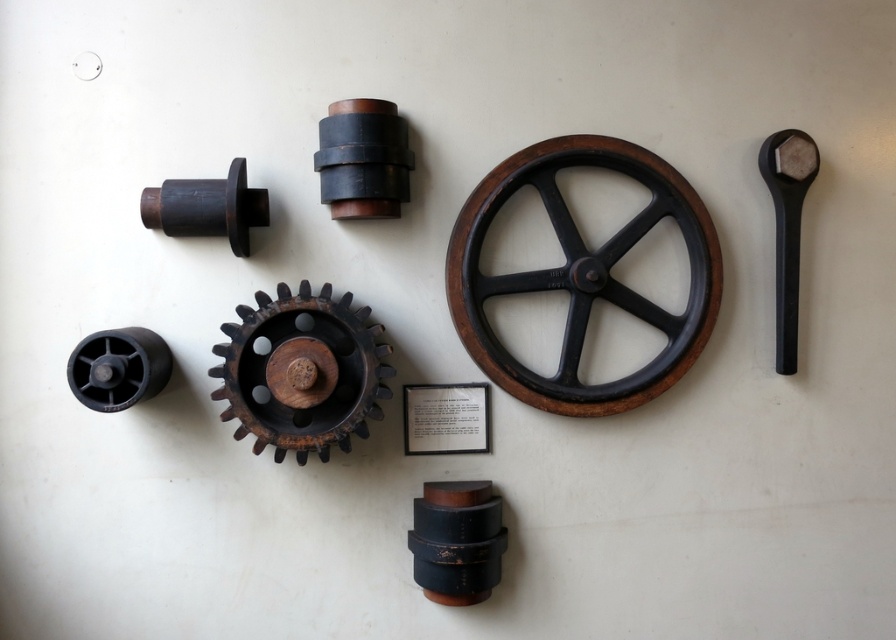
Question: Does matte black cylinder at upper left lie in front of black rubber wheel at lower left?

Choices:
 (A) no
 (B) yes

Answer: (A)

Question: Is the position of matte black cylinder at upper center more distant than that of matte black cylinder at upper left?

Choices:
 (A) yes
 (B) no

Answer: (A)

Question: Is wooden/black wheel at center smaller than rusty metal gear at center?

Choices:
 (A) no
 (B) yes

Answer: (A)

Question: Among these points, which one is nearest to the camera?

Choices:
 (A) (231, 401)
 (B) (169, 220)
 (C) (87, 401)

Answer: (C)

Question: Based on their relative distances, which object is farther from the matte black cylinder at upper center?

Choices:
 (A) matte black cylinder at upper left
 (B) wooden/black wheel at center

Answer: (B)

Question: Considering the real-world distances, which object is closest to the black rubber wheel at lower left?

Choices:
 (A) matte black cylinder at upper left
 (B) matte black cylinder at upper center
 (C) wooden/black wheel at center

Answer: (A)